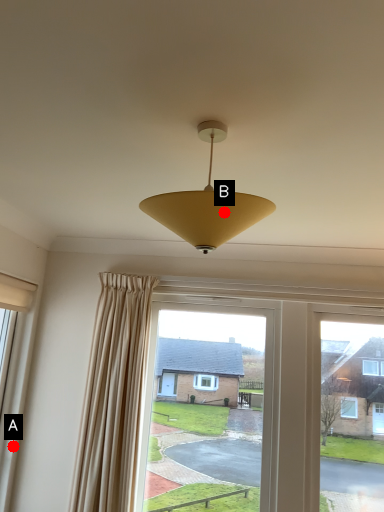
Question: Two points are circled on the image, labeled by A and B beside each circle. Which point is closer to the camera?

Choices:
 (A) A is closer
 (B) B is closer

Answer: (B)